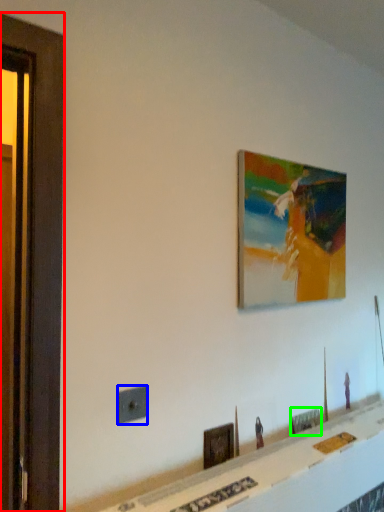
Question: Which object is the farthest from screen door (highlighted by a red box)? Choose among these: electric outlet (highlighted by a blue box) or picture frame (highlighted by a green box).

Choices:
 (A) electric outlet
 (B) picture frame

Answer: (B)